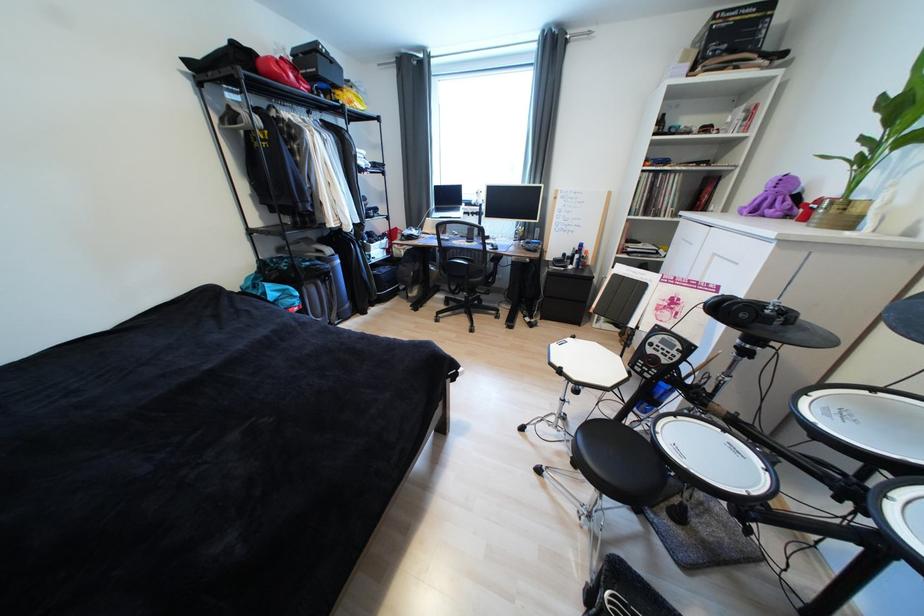
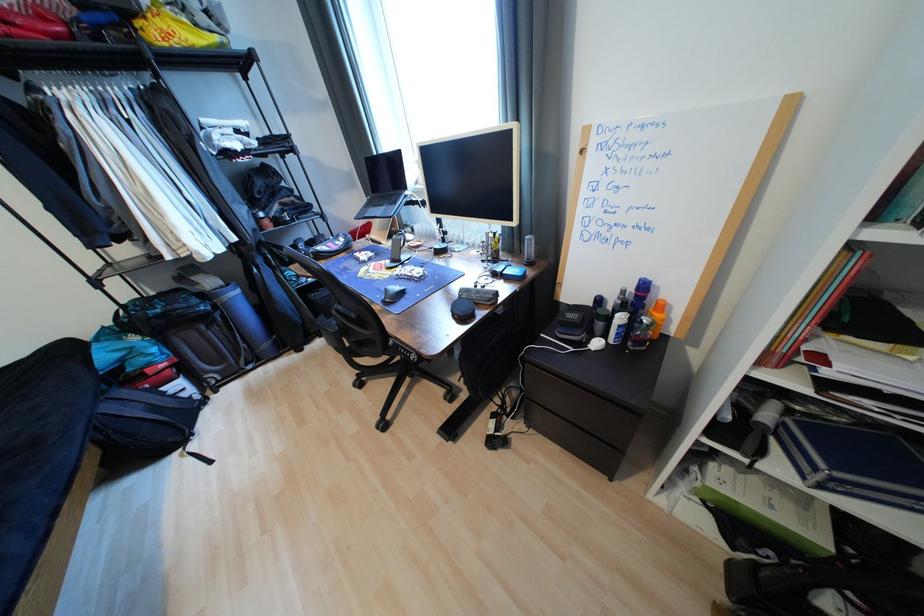
Locate, in the second image, the point that corresponds to point (584, 257) in the first image.

(627, 320)